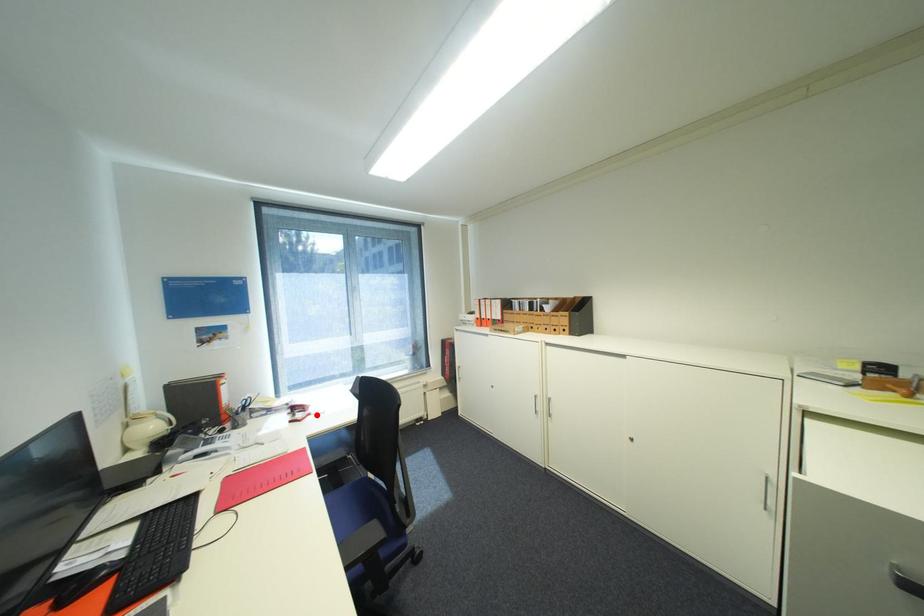
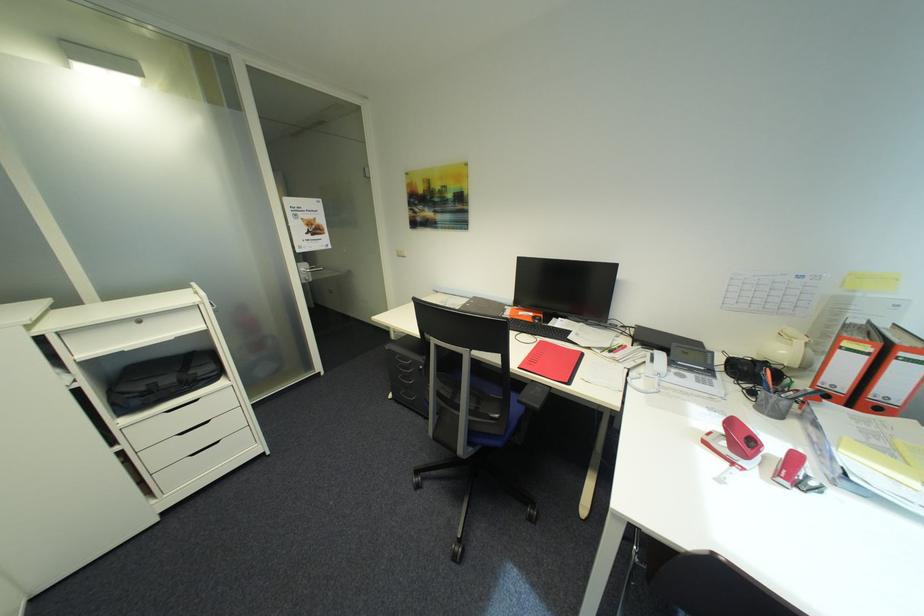
Locate, in the second image, the point that corresponds to the highlighted location in the first image.

(742, 464)